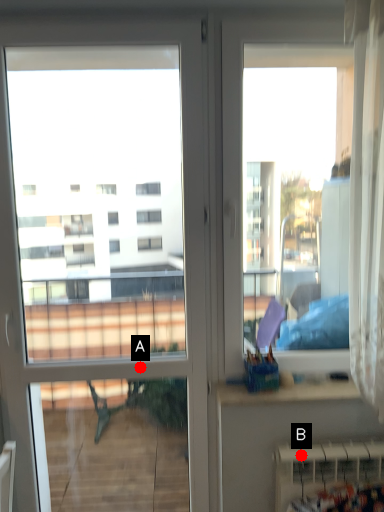
Question: Two points are circled on the image, labeled by A and B beside each circle. Which of the following is the farthest from the observer?

Choices:
 (A) A is further
 (B) B is further

Answer: (A)